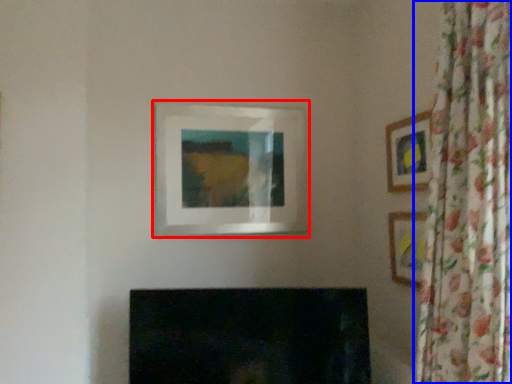
Question: Which object appears closest to the camera in this image, picture frame (highlighted by a red box) or curtain (highlighted by a blue box)?

Choices:
 (A) picture frame
 (B) curtain

Answer: (B)